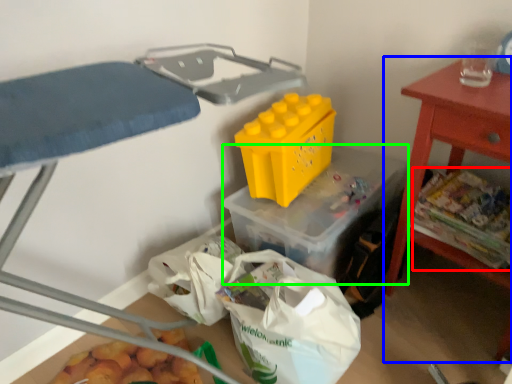
Question: Which is farther away from food (highlighted by a red box)? table (highlighted by a blue box) or storage box (highlighted by a green box)?

Choices:
 (A) table
 (B) storage box

Answer: (B)